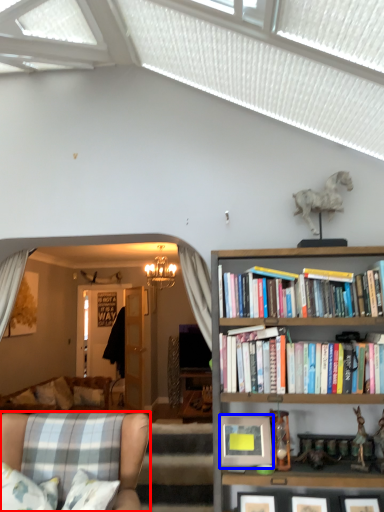
Question: Which of the following is the farthest to the observer, chair (highlighted by a red box) or picture frame (highlighted by a blue box)?

Choices:
 (A) chair
 (B) picture frame

Answer: (B)